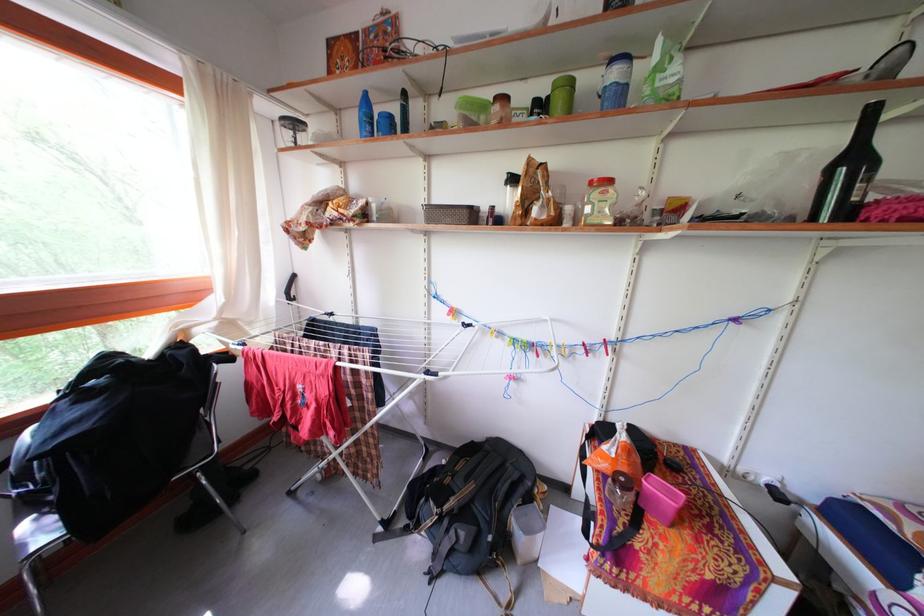
Which object does [848,172] point to?

It refers to a black wine bottle.